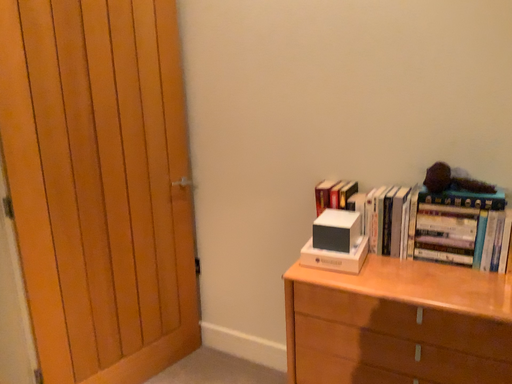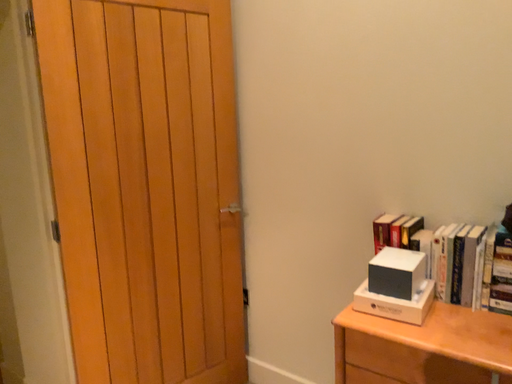
Question: How did the camera likely rotate when shooting the video?

Choices:
 (A) rotated right
 (B) rotated left

Answer: (B)